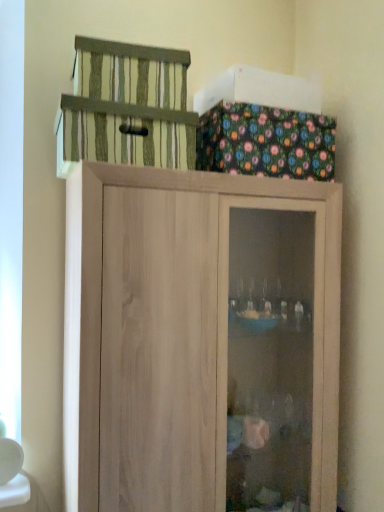
Question: Can you see striped fabric cage at upper center touching natural wood cupboard at upper center?

Choices:
 (A) yes
 (B) no

Answer: (B)

Question: From a real-world perspective, is striped fabric cage at upper center positioned over natural wood cupboard at upper center based on gravity?

Choices:
 (A) no
 (B) yes

Answer: (B)

Question: Can you confirm if striped fabric cage at upper center is positioned to the right of natural wood cupboard at upper center?

Choices:
 (A) yes
 (B) no

Answer: (B)

Question: Would you say striped fabric cage at upper center is outside natural wood cupboard at upper center?

Choices:
 (A) no
 (B) yes

Answer: (B)

Question: Is striped fabric cage at upper center turned away from natural wood cupboard at upper center?

Choices:
 (A) no
 (B) yes

Answer: (A)

Question: Does striped fabric cage at upper center come behind natural wood cupboard at upper center?

Choices:
 (A) yes
 (B) no

Answer: (A)

Question: From the image's perspective, is natural wood cupboard at upper center above striped fabric cage at upper center?

Choices:
 (A) no
 (B) yes

Answer: (A)

Question: From a real-world perspective, is natural wood cupboard at upper center below striped fabric cage at upper center?

Choices:
 (A) no
 (B) yes

Answer: (B)

Question: From a real-world perspective, is natural wood cupboard at upper center physically above striped fabric cage at upper center?

Choices:
 (A) no
 (B) yes

Answer: (A)

Question: Can we say natural wood cupboard at upper center lies outside striped fabric cage at upper center?

Choices:
 (A) no
 (B) yes

Answer: (B)

Question: From the image's perspective, is natural wood cupboard at upper center located beneath striped fabric cage at upper center?

Choices:
 (A) yes
 (B) no

Answer: (A)

Question: Does natural wood cupboard at upper center have a lesser height compared to striped fabric cage at upper center?

Choices:
 (A) yes
 (B) no

Answer: (B)

Question: Is striped fabric cage at upper center to the left or to the right of natural wood cupboard at upper center in the image?

Choices:
 (A) right
 (B) left

Answer: (B)